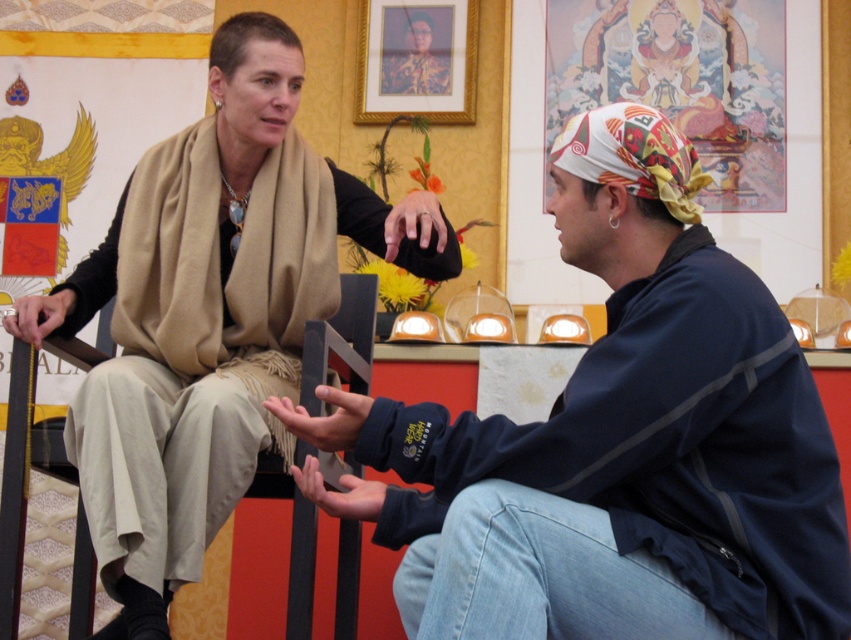
Which of these two, matte black jacket at center or beige wool scarf at upper left, stands shorter?

matte black jacket at center is shorter.

Who is more forward, (740,481) or (220,436)?

Point (740,481)

Locate an element on the screen. matte black jacket at center is located at coordinates (617, 442).

How far apart are wooden chair at center and gold-framed portrait at upper center?

wooden chair at center is 14.54 meters from gold-framed portrait at upper center.

Can you confirm if wooden chair at center is thinner than gold-framed portrait at upper center?

Incorrect, wooden chair at center's width is not less than gold-framed portrait at upper center's.

What do you see at coordinates (341, 340) in the screenshot? I see `wooden chair at center` at bounding box center [341, 340].

At what (x,y) coordinates should I click in order to perform the action: click on wooden chair at center. Please return your answer as a coordinate pair (x, y). The height and width of the screenshot is (640, 851). Looking at the image, I should click on (341, 340).

How much distance is there between beige wool scarf at upper left and gold-framed portrait at upper center?

The distance of beige wool scarf at upper left from gold-framed portrait at upper center is 46.21 feet.

Locate an element on the screen. The image size is (851, 640). beige wool scarf at upper left is located at coordinates (155, 432).

Image resolution: width=851 pixels, height=640 pixels. Find the location of `beige wool scarf at upper left`. beige wool scarf at upper left is located at coordinates (155, 432).